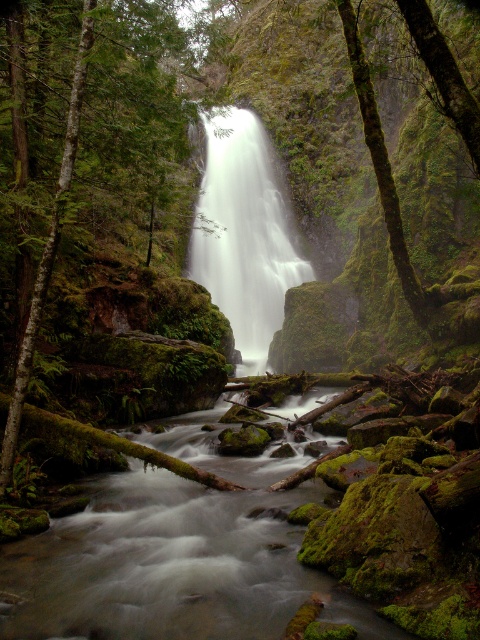
You are a photographer planning to capture the white smooth waterfall at center and the green mossy tree at left in a single frame. Based on their sizes, which one will occupy more space in the photo?

The white smooth waterfall at center is larger in size than the green mossy tree at left, so it will occupy more space in the photo.

You are standing in front of the waterfall and notice two points marked in the scene. The first point is at coordinates point (x=236, y=227) and the second is at point (x=91, y=44). Which of these two points is closer to your current position?

Point (x=236, y=227) is closer to your current position because it is further to the viewer than point (x=91, y=44).